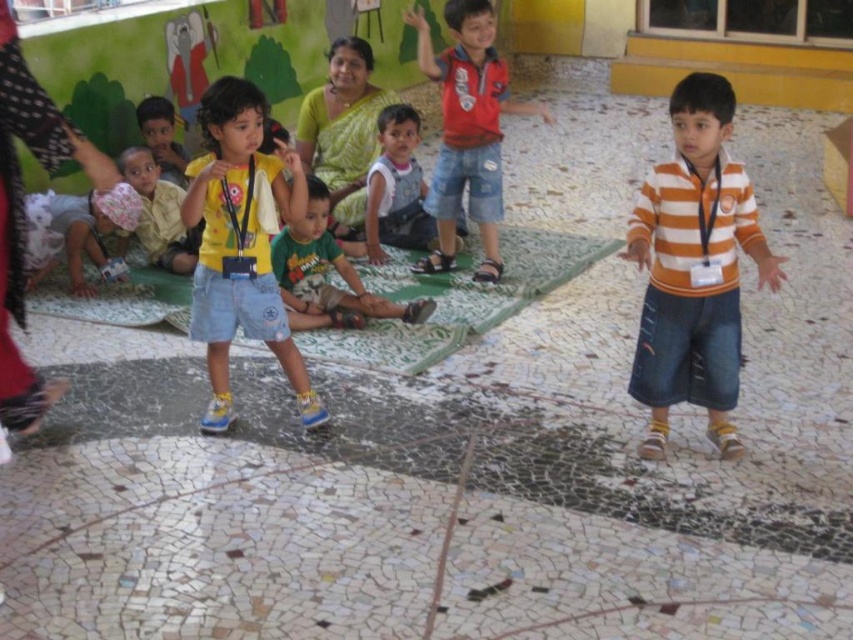
What are the coordinates of the green cotton shirt at center?

The green cotton shirt at center is located at point [325,275].

You are a teacher in the classroom. You need to arrange the children so that the shorter one stands in front. Which child should stand in front between the red shirt at center and the white cotton dress at lower left?

The white cotton dress at lower left should stand in front because it is shorter than the red shirt at center.